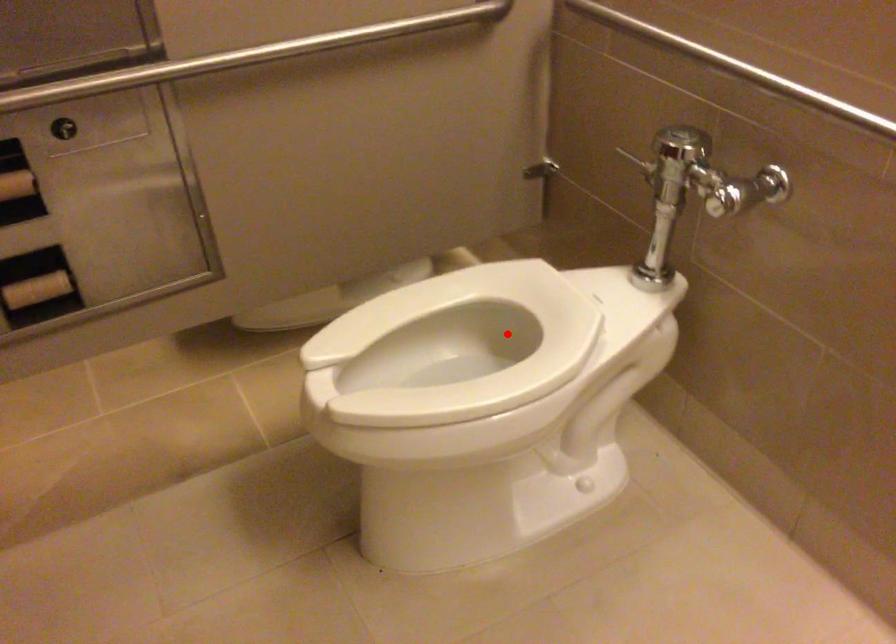
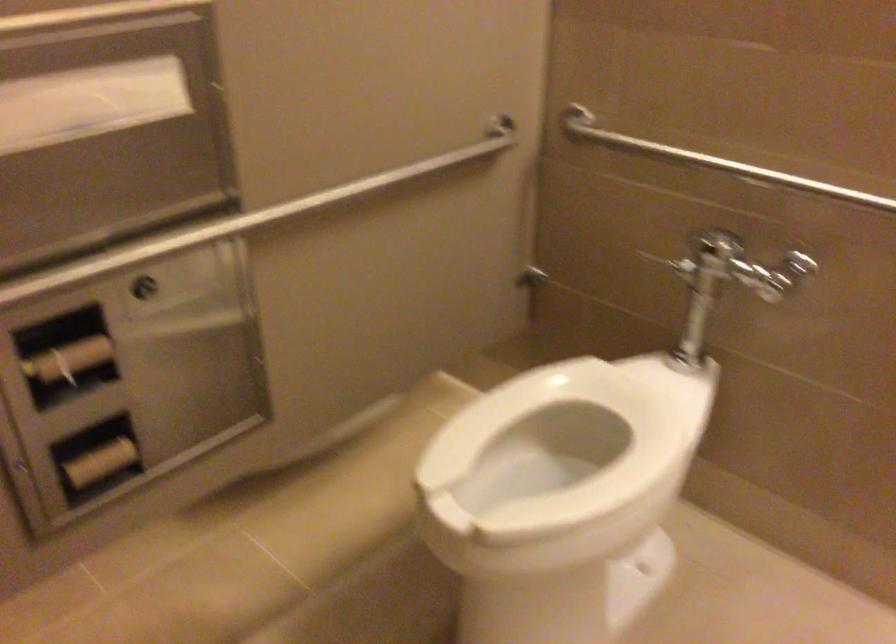
Question: I am providing you with two images of the same scene from different viewpoints. A red point is marked on the first image. Can you still see the location of the red point in image 2?

Choices:
 (A) Yes
 (B) No

Answer: (A)